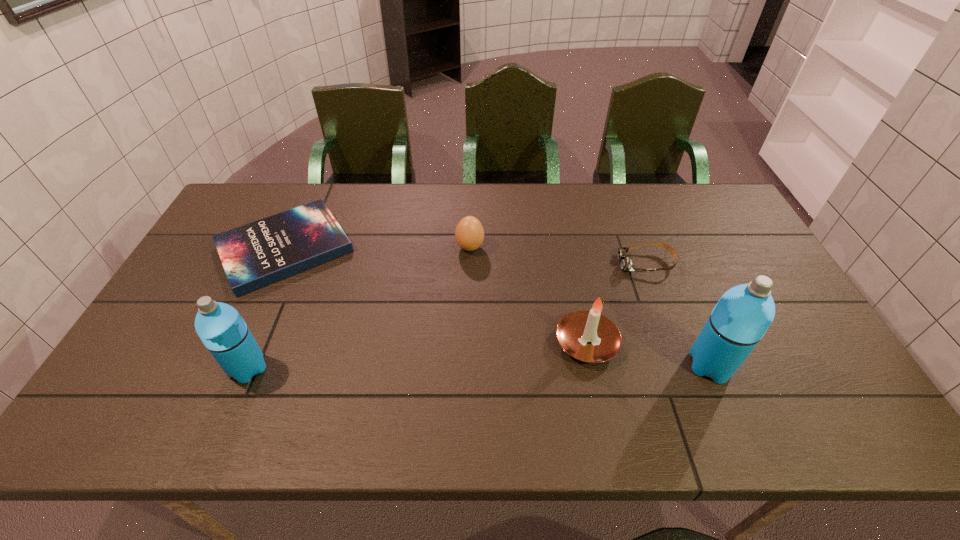
Locate an element on the screen. unoccupied area between the shortest object and the fifth tallest object is located at coordinates coord(466,255).

I want to click on empty location between the second shortest object and the left thermos bottle, so click(x=447, y=316).

Identify the location of free space between the third object from right to left and the hardback book. (436, 295).

Identify the location of vacant region between the candle and the goggles. Image resolution: width=960 pixels, height=540 pixels. (616, 303).

The width and height of the screenshot is (960, 540). I want to click on unoccupied position between the taller thermos bottle and the hardback book, so click(497, 306).

At what (x,y) coordinates should I click in order to perform the action: click on unoccupied area between the fourth object from right to left and the fifth shortest object. Please return your answer as a coordinate pair (x, y). This screenshot has width=960, height=540. Looking at the image, I should click on (359, 308).

Where is `free space between the taller thermos bottle and the hardback book`? free space between the taller thermos bottle and the hardback book is located at coordinates (497, 306).

This screenshot has width=960, height=540. Find the location of `object that can be found as the fifth closest to the third shortest object`. object that can be found as the fifth closest to the third shortest object is located at coordinates (743, 314).

The height and width of the screenshot is (540, 960). I want to click on object that stands as the fifth closest to the tallest object, so click(x=222, y=330).

Find the location of `free space that satisfies the following two spatial constraints: 1. on the front side of the boiled egg; 2. on the right side of the fourth shortest object`. free space that satisfies the following two spatial constraints: 1. on the front side of the boiled egg; 2. on the right side of the fourth shortest object is located at coordinates (468, 342).